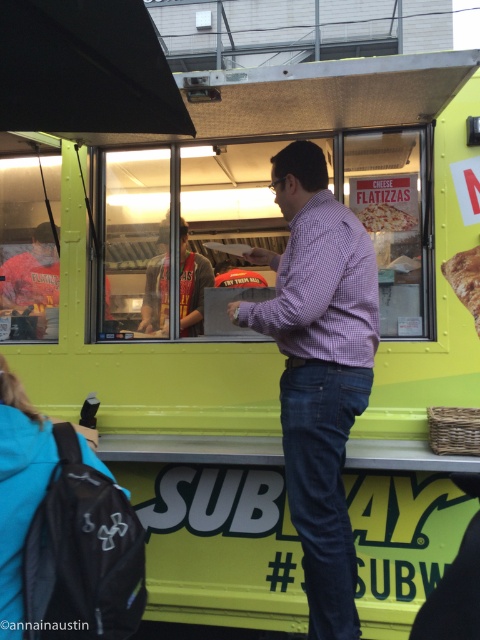
You are a customer waiting in line at the Subway food truck. You notice a man in a gray fabric shirt at center and a cheese pizza at center. Which object is positioned to the right side?

The cheese pizza at center is to the right of the gray fabric shirt at center.

You are a customer waiting in line for your sandwich. You see the gray fabric shirt at center and the golden brown bread at right. Which item is located higher in the image?

The gray fabric shirt at center is located higher than the golden brown bread at right in the image.

You are standing at the entrance of the food truck and want to hand an order slip to the person wearing the gray fabric shirt at center. Based on your position, in which direction should you move to reach them?

The gray fabric shirt at center is located at point 0.447 on the x and 0.400 on the y axis, so you should move towards the center of the food truck to reach them.